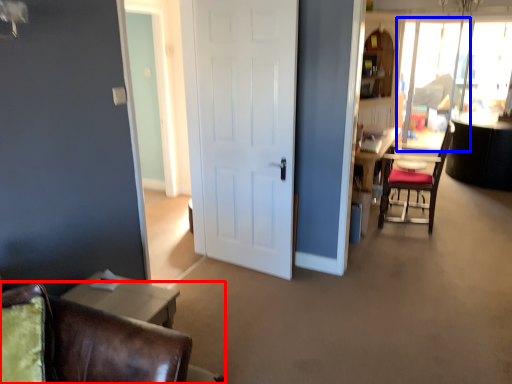
Question: Which object is closer to the camera taking this photo, chair (highlighted by a red box) or window screen (highlighted by a blue box)?

Choices:
 (A) chair
 (B) window screen

Answer: (A)